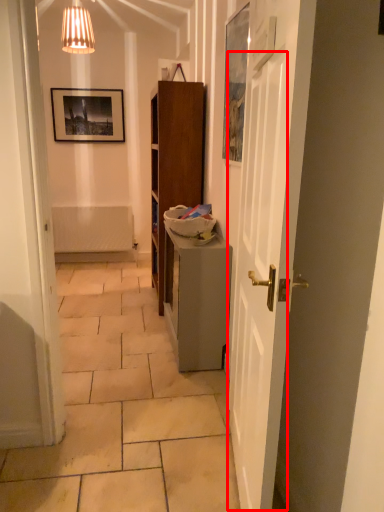
Question: Where is door (annotated by the red box) located in relation to table in the image?

Choices:
 (A) right
 (B) left

Answer: (A)